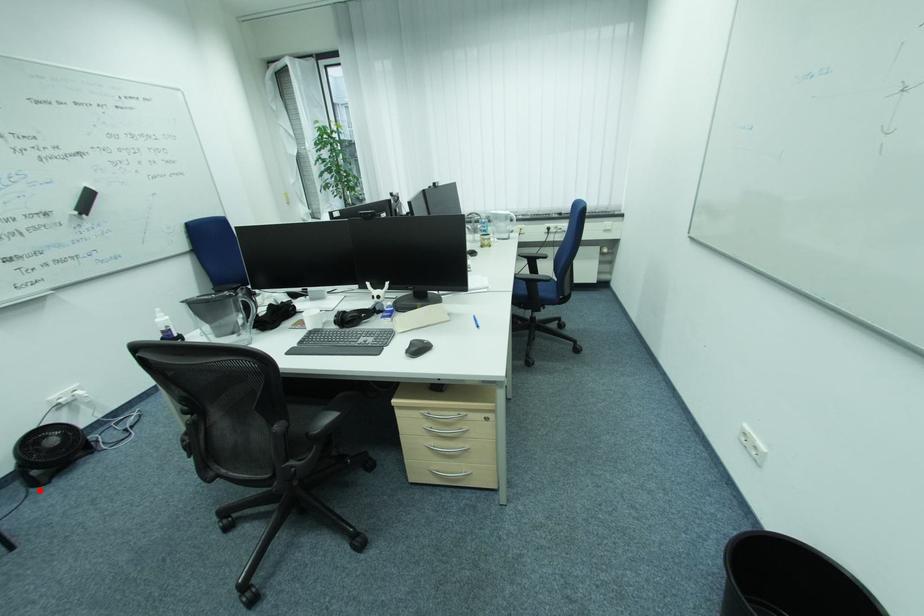
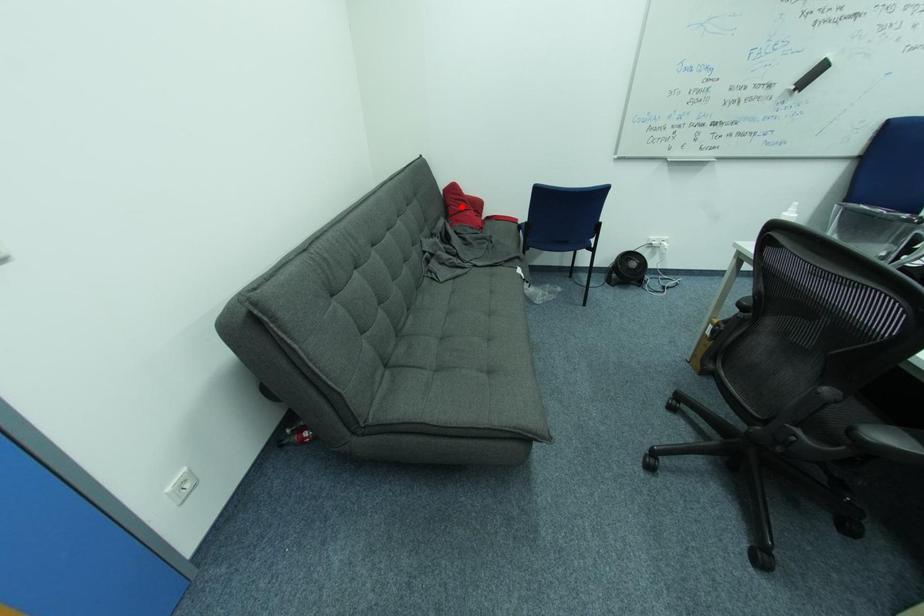
I am providing you with two images of the same scene from different viewpoints. A red point is marked on the first image and another point is marked on the second image. Are the points marked in image1 and image2 representing the same 3D position?

No